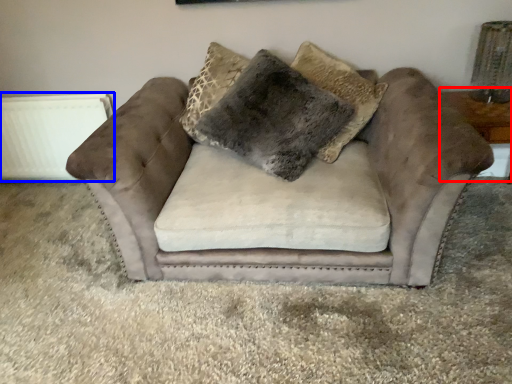
Question: Which object is further to the camera taking this photo, table (highlighted by a red box) or radiator (highlighted by a blue box)?

Choices:
 (A) table
 (B) radiator

Answer: (B)